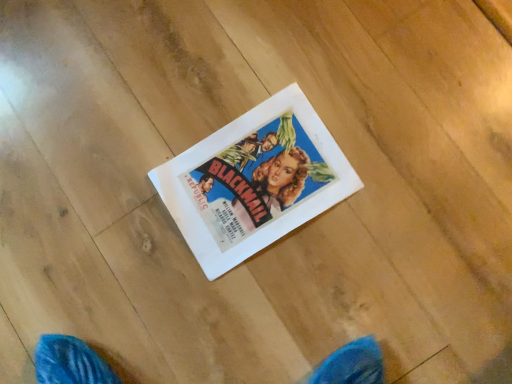
Question: Should I look upward or downward to see white paper at center?

Choices:
 (A) up
 (B) down

Answer: (A)